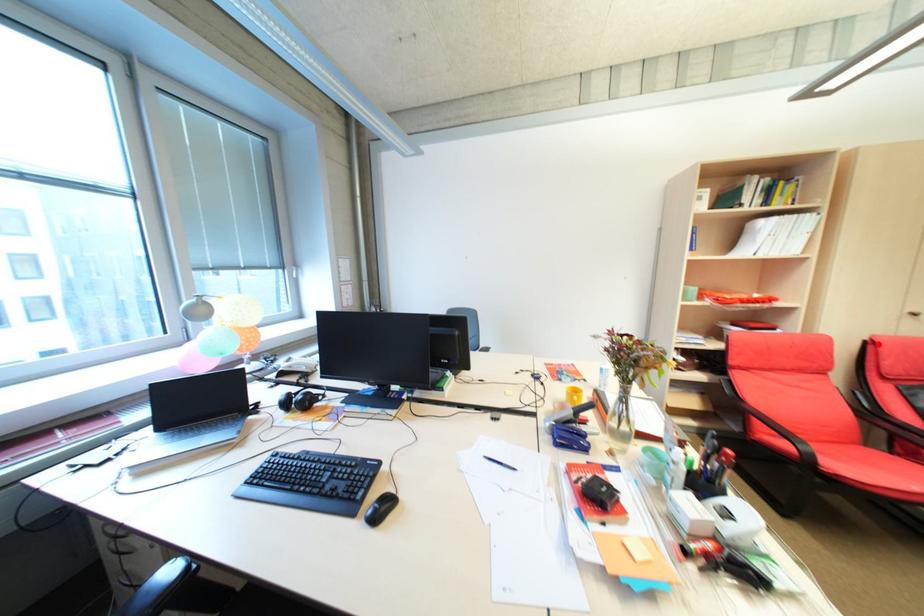
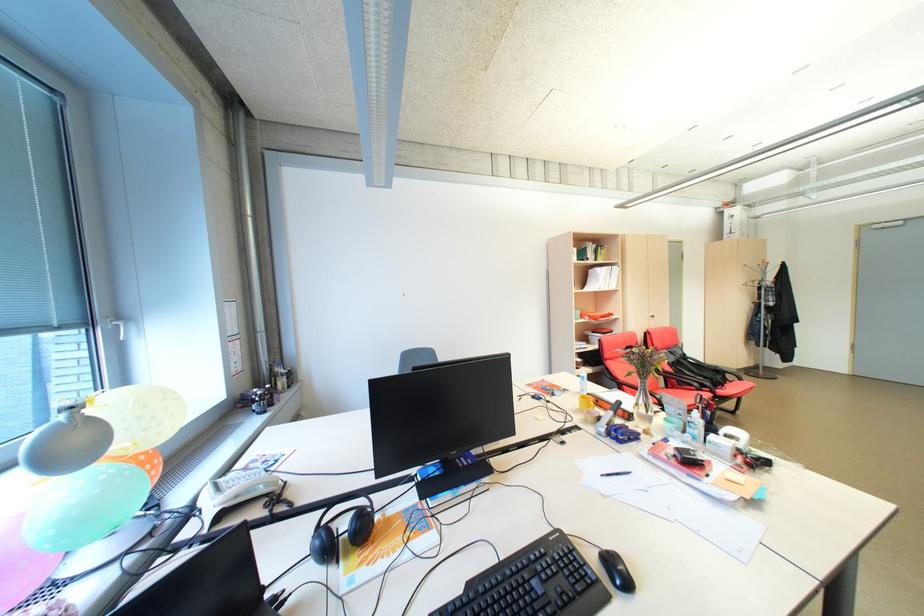
Question: I am providing you with two images of the same scene from different viewpoints. Given a red point in image1, look at the same physical point in image2. Is it:

Choices:
 (A) Closer to the viewpoint
 (B) Farther from the viewpoint

Answer: (B)